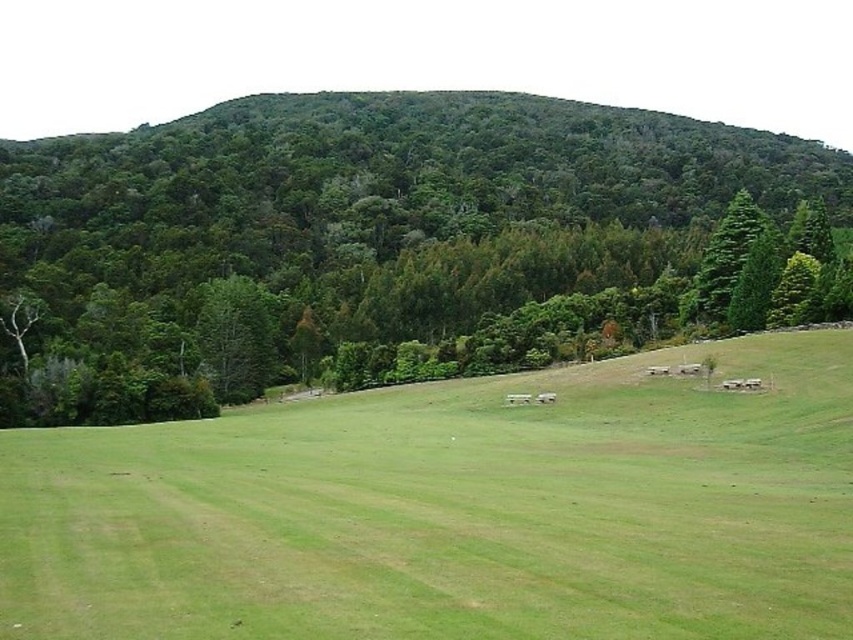
Question: Can you confirm if green grassy pasture at center is smaller than green leafy tree at upper center?

Choices:
 (A) yes
 (B) no

Answer: (A)

Question: Can you confirm if green grassy pasture at center is positioned above green leafy tree at upper center?

Choices:
 (A) yes
 (B) no

Answer: (B)

Question: Which point is farther to the camera?

Choices:
 (A) green leafy tree at upper center
 (B) green grassy pasture at center

Answer: (A)

Question: Is green grassy pasture at center smaller than green leafy tree at upper center?

Choices:
 (A) yes
 (B) no

Answer: (A)